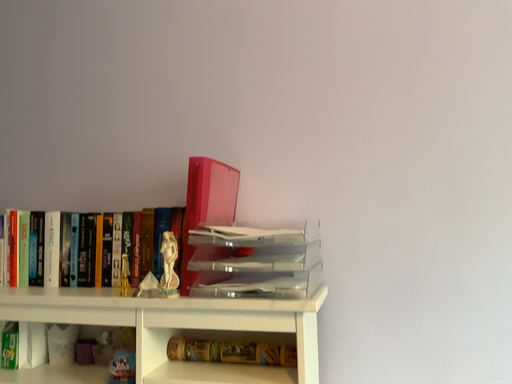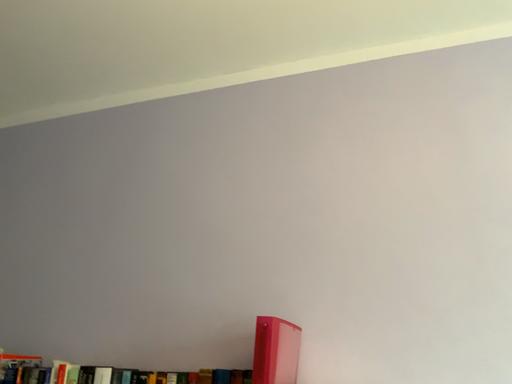
Question: Which way did the camera rotate in the video?

Choices:
 (A) rotated upward
 (B) rotated downward

Answer: (A)